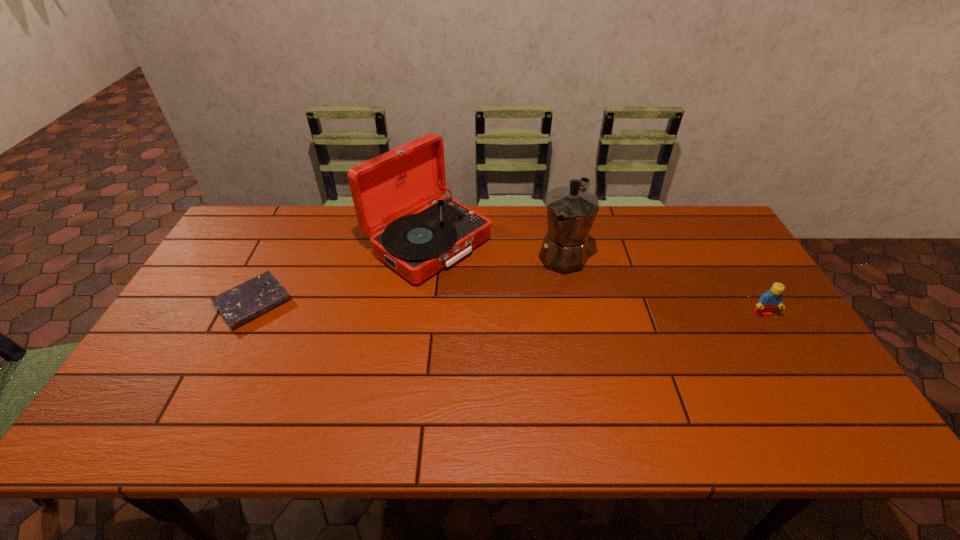
In order to click on vacant area situated 0.210m on the pouring side of the third object from left to right in this screenshot , I will do `click(528, 324)`.

Identify the location of vacant space located 0.270m on the front-facing side of the phonograph_record. (542, 320).

Find the location of `free space located 0.200m on the front-facing side of the phonograph_record`. free space located 0.200m on the front-facing side of the phonograph_record is located at coordinates (523, 307).

The image size is (960, 540). Identify the location of vacant area situated on the front-facing side of the phonograph_record. (484, 281).

Where is `coffeepot located at the far edge`? coffeepot located at the far edge is located at coordinates (571, 211).

Identify the location of phonograph_record located in the far edge section of the desktop. (386, 189).

Find the location of a particular element. The height and width of the screenshot is (540, 960). object that is at the left edge is located at coordinates (239, 305).

Where is `object that is positioned at the right edge`? The height and width of the screenshot is (540, 960). object that is positioned at the right edge is located at coordinates (768, 301).

Locate an element on the screen. free space at the far edge of the desktop is located at coordinates (337, 243).

In the image, there is a desktop. What are the coordinates of `vacant region at the near edge` in the screenshot? It's located at (459, 392).